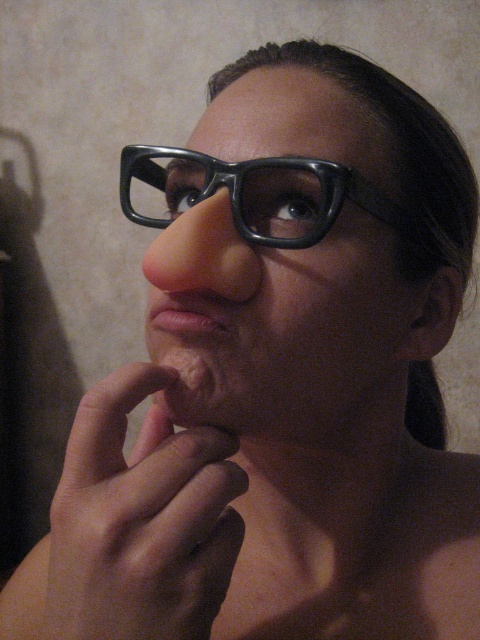
Question: Which object is closer to the camera taking this photo?

Choices:
 (A) rubber-like flesh-colored nose at center
 (B) matte black glasses at center

Answer: (A)

Question: Can you confirm if matte black glasses at center is positioned above matte pink lips at center?

Choices:
 (A) yes
 (B) no

Answer: (A)

Question: Which of these objects is positioned closest to the rubber-like flesh-colored nose at center?

Choices:
 (A) matte black glasses at center
 (B) smooth skin hand at center
 (C) matte pink lips at center

Answer: (C)

Question: Which object is the farthest from the matte pink lips at center?

Choices:
 (A) rubber-like flesh-colored nose at center
 (B) matte black glasses at center

Answer: (B)

Question: Where is matte black glasses at center located in relation to rubber-like flesh-colored nose at center in the image?

Choices:
 (A) right
 (B) left

Answer: (A)

Question: Is black plastic glasses at center below matte pink lips at center?

Choices:
 (A) no
 (B) yes

Answer: (A)